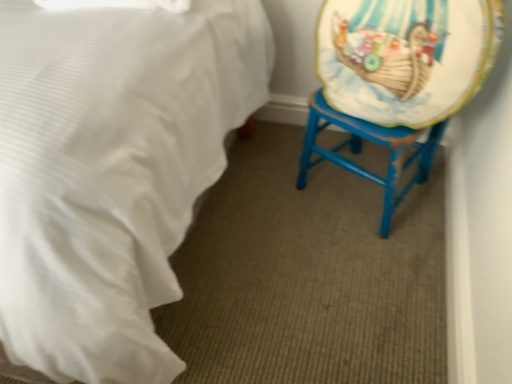
Image resolution: width=512 pixels, height=384 pixels. Find the location of `vacant area situated below blue painted wood swivel chair at right (from a real-world perspective)`. vacant area situated below blue painted wood swivel chair at right (from a real-world perspective) is located at coordinates (360, 189).